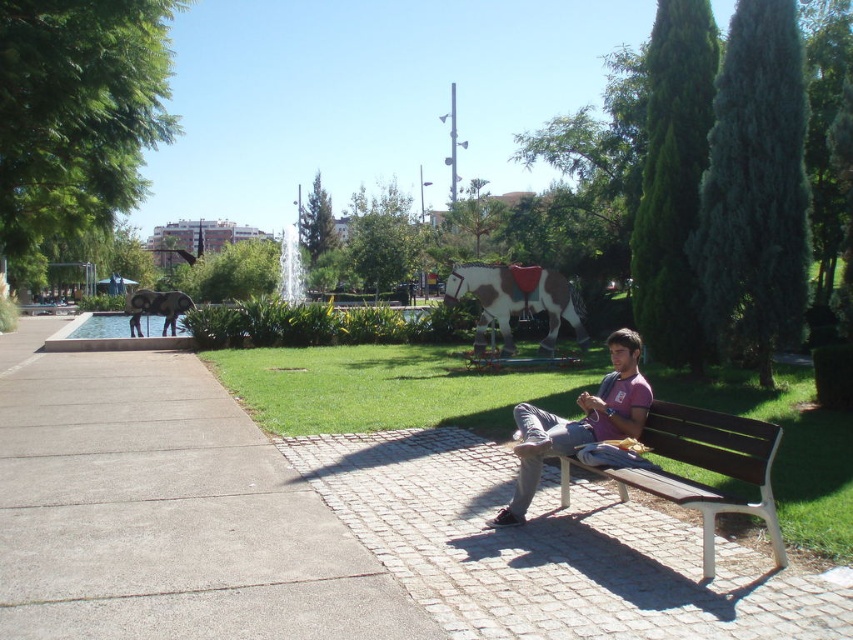
Question: Is paved stone bench at center to the left of light brown denim pants at center from the viewer's perspective?

Choices:
 (A) yes
 (B) no

Answer: (B)

Question: Which point is closer to the camera?

Choices:
 (A) (740, 480)
 (B) (143, 312)
 (C) (607, 422)
 (D) (494, 276)

Answer: (A)

Question: Is light brown denim pants at center below brown and white painted horse at center?

Choices:
 (A) no
 (B) yes

Answer: (B)

Question: Among these points, which one is farthest from the camera?

Choices:
 (A) (556, 333)
 (B) (672, 440)
 (C) (485, 502)
 (D) (166, 292)

Answer: (D)

Question: Can you confirm if paved stone bench at center is positioned to the right of brown wooden bench at center?

Choices:
 (A) no
 (B) yes

Answer: (A)

Question: Which object is farther from the camera taking this photo?

Choices:
 (A) brown and white painted horse at center
 (B) paved stone bench at center
 (C) light brown denim pants at center

Answer: (A)